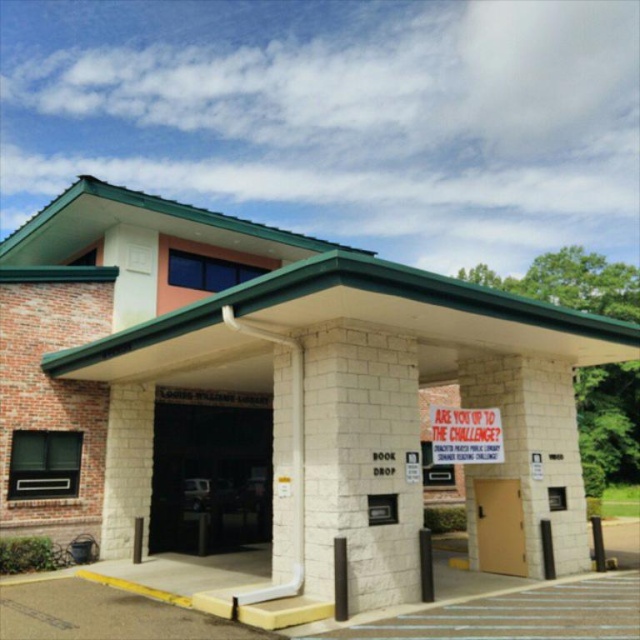
Question: Among these points, which one is farthest from the camera?

Choices:
 (A) (230, 417)
 (B) (497, 432)
 (C) (333, 417)

Answer: (A)

Question: Which point appears closest to the camera in this image?

Choices:
 (A) (244, 515)
 (B) (381, 435)

Answer: (B)

Question: Does brown matte door at center have a larger size compared to red fabric sign at center?

Choices:
 (A) no
 (B) yes

Answer: (A)

Question: Which point appears farthest from the camera in this image?

Choices:
 (A) (486, 545)
 (B) (356, 608)

Answer: (A)

Question: Is white stone book drop at center smaller than red fabric sign at center?

Choices:
 (A) no
 (B) yes

Answer: (A)

Question: In this image, where is white brick building at center located relative to brown matte door at center?

Choices:
 (A) below
 (B) above

Answer: (B)